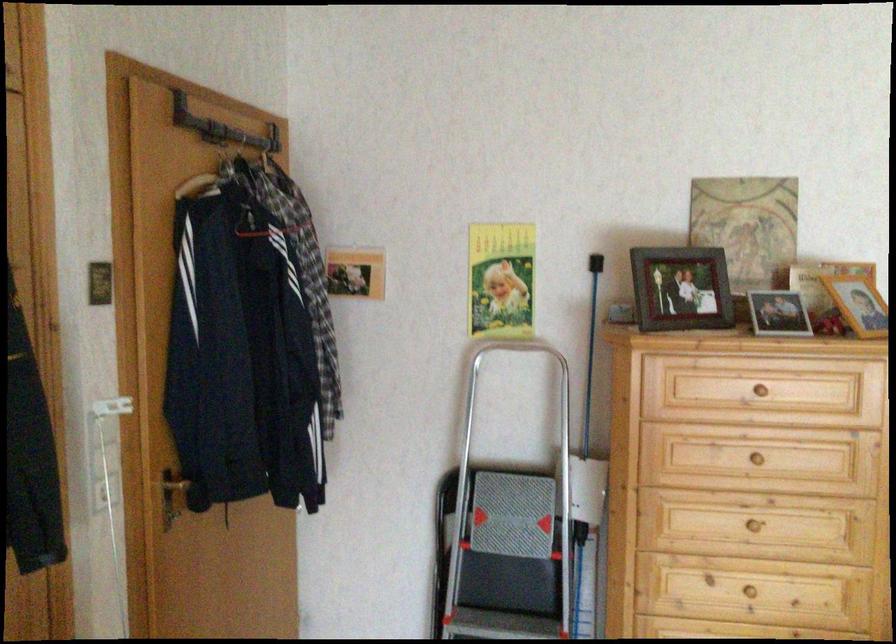
This screenshot has width=896, height=644. Identify the location of white light switch. (104, 449).